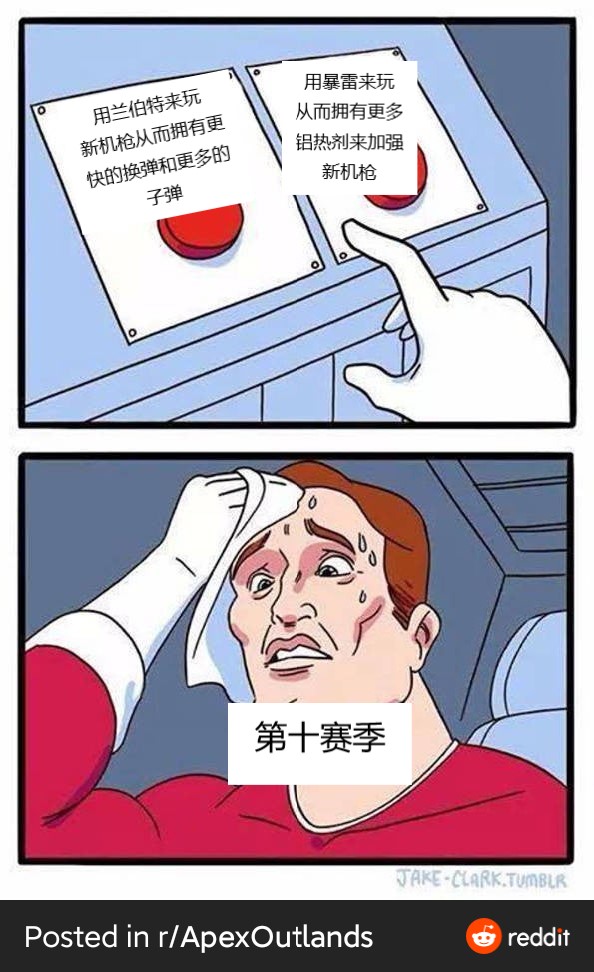
The height and width of the screenshot is (972, 594). Identify the location of towel. (271, 502).